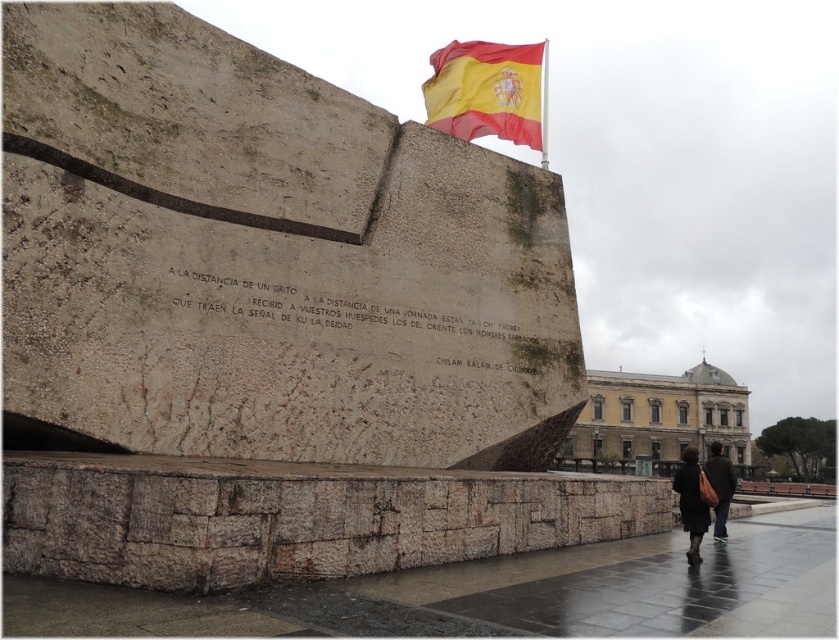
Question: Which of these objects is positioned farthest from the dark brown leather coat at lower right?

Choices:
 (A) dark brown leather jacket at lower right
 (B) red/yellow fabric flag at upper center

Answer: (B)

Question: Among these objects, which one is farthest from the camera?

Choices:
 (A) red/yellow fabric flag at upper center
 (B) dark brown leather jacket at lower right

Answer: (A)

Question: Which point is farther from the camera taking this photo?

Choices:
 (A) (696, 467)
 (B) (537, 109)
 (C) (717, 515)

Answer: (B)

Question: Does red/yellow fabric flag at upper center appear under dark brown leather jacket at lower right?

Choices:
 (A) yes
 (B) no

Answer: (B)

Question: From the image, what is the correct spatial relationship of red/yellow fabric flag at upper center in relation to dark brown leather coat at lower right?

Choices:
 (A) below
 (B) above

Answer: (B)

Question: In this image, where is dark brown leather coat at lower right located relative to dark brown leather jacket at lower right?

Choices:
 (A) above
 (B) below

Answer: (A)